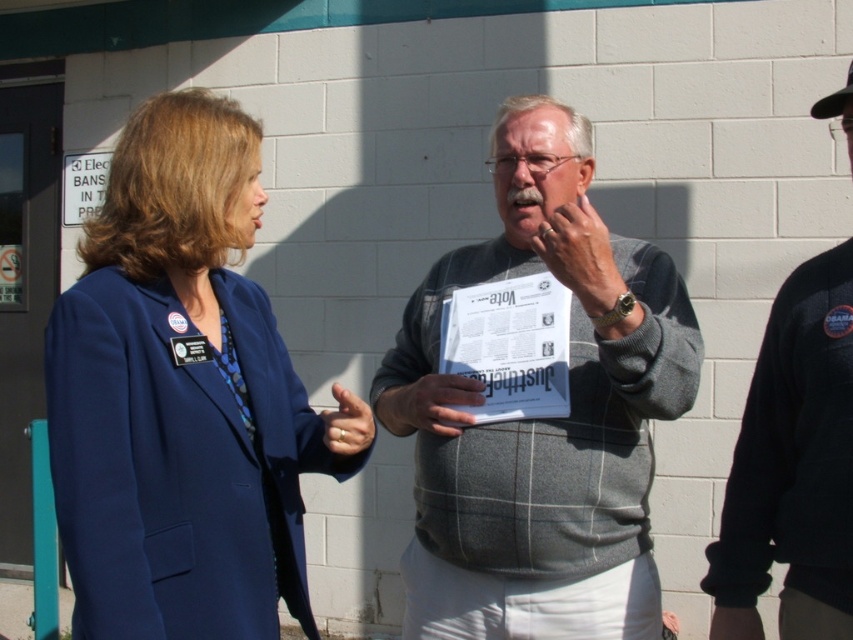
You are an observer standing in front of the teal door frame. You see the blue fabric jacket at center and the gray plaid sweater at center. Which clothing item is shorter in length?

The blue fabric jacket at center is shorter than the gray plaid sweater at center.

You are a tailor who needs to determine which garment requires more fabric for alterations. Based on the image, which of the two garments, the gray plaid sweater at center or the black fleece jacket at right, would need more fabric due to its larger size?

The gray plaid sweater at center requires more fabric because its width is larger than the black fleece jacket at right.

Based on the photo, you are a photographer trying to capture a candid shot of the two people in the scene. The blue fabric jacket at center and the black fleece jacket at right are both in your viewfinder. Based on their positions, which jacket is closer to the camera?

The blue fabric jacket at center is located above the black fleece jacket at right, which means it is closer to the camera.